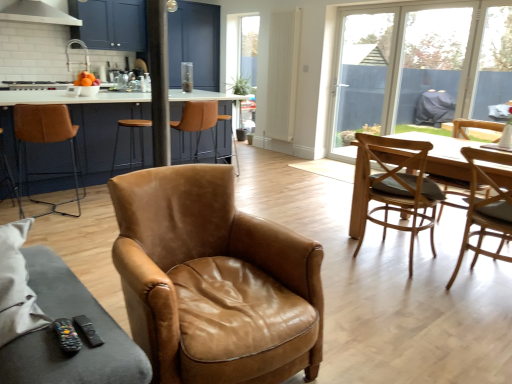
I want to click on transparent glass window at upper right, the third window screen when ordered from left to right, so click(x=494, y=63).

Where is `matte brown table at center`? This screenshot has height=384, width=512. matte brown table at center is located at coordinates (67, 97).

Measure the distance between white glossy exhaust hood at upper left and camera.

white glossy exhaust hood at upper left and camera are 3.95 meters apart from each other.

Describe the element at coordinates (485, 209) in the screenshot. This screenshot has width=512, height=384. I see `light brown leather chair at right, placed as the 2th chair when sorted from right to left` at that location.

The height and width of the screenshot is (384, 512). Identify the location of transparent glass window at upper right, the third window screen when ordered from left to right. (494, 63).

Can you confirm if brown leather bar stool at center is wider than matte brown table at center?

No.

From a real-world perspective, is brown leather bar stool at center above or below matte brown table at center?

Clearly, from a real-world perspective, brown leather bar stool at center is below matte brown table at center.

Based on the photo, is brown leather bar stool at center with matte brown table at center?

No, brown leather bar stool at center is not touching matte brown table at center.

Can you tell me how much brown leather bar stool at center and matte brown table at center differ in facing direction?

178 degrees.

Which is less distant, [150,122] or [474,182]?

Point [150,122] is farther from the camera than point [474,182].

Would you consider brown leather stool at center to be distant from light brown leather chair at right, placed as the 2th chair when sorted from right to left?

Indeed, brown leather stool at center is not near light brown leather chair at right, placed as the 2th chair when sorted from right to left.

Is transparent glass window at upper right, the third window screen when ordered from left to right, facing away from light brown wooden chair at right, the 1th chair when ordered from right to left?

transparent glass window at upper right, the third window screen when ordered from left to right, is not turned away from light brown wooden chair at right, the 1th chair when ordered from right to left.

From the image's perspective, is transparent glass window at upper right, positioned as the first window screen in right-to-left order, above or below light brown wooden chair at right, the 1th chair when ordered from right to left?

From the image's perspective, transparent glass window at upper right, positioned as the first window screen in right-to-left order, appears above light brown wooden chair at right, the 1th chair when ordered from right to left.

Which is more to the left, transparent glass window at upper right, the third window screen when ordered from left to right, or light brown wooden chair at right, which appears as the 6th chair when viewed from the left?

light brown wooden chair at right, which appears as the 6th chair when viewed from the left.

From a real-world perspective, is transparent glass window at upper right, the third window screen when ordered from left to right, physically located above or below light brown wooden chair at right, which appears as the 6th chair when viewed from the left?

Clearly, from a real-world perspective, transparent glass window at upper right, the third window screen when ordered from left to right, is above light brown wooden chair at right, which appears as the 6th chair when viewed from the left.

From the image's perspective, between light brown leather chair at right, which is counted as the fifth chair, starting from the left, and transparent glass window at upper right, the third window screen when ordered from left to right, who is located below?

From the image's view, light brown leather chair at right, which is counted as the fifth chair, starting from the left, is below.

Looking at this image, relative to transparent glass window at upper right, positioned as the first window screen in right-to-left order, is light brown leather chair at right, which is counted as the fifth chair, starting from the left, in front or behind?

light brown leather chair at right, which is counted as the fifth chair, starting from the left, is in front of transparent glass window at upper right, positioned as the first window screen in right-to-left order.

Is transparent glass window at upper right, the third window screen when ordered from left to right, at the back of light brown leather chair at right, which is counted as the fifth chair, starting from the left?

No, transparent glass window at upper right, the third window screen when ordered from left to right, is not at the back of light brown leather chair at right, which is counted as the fifth chair, starting from the left.

Considering the sizes of objects black plastic remote at lower left and brown leather stool at center in the image provided, who is shorter, black plastic remote at lower left or brown leather stool at center?

black plastic remote at lower left.

Which object is more forward, black plastic remote at lower left or brown leather stool at center?

black plastic remote at lower left is in front.

Looking at their sizes, would you say black plastic remote at lower left is wider or thinner than brown leather stool at center?

Considering their sizes, black plastic remote at lower left looks slimmer than brown leather stool at center.

Based on the photo, does light brown wooden chair at right, which appears as the 6th chair when viewed from the left, have a lesser height compared to light brown leather chair at right, placed as the 2th chair when sorted from right to left?

No.

Could light brown leather chair at right, which is counted as the fifth chair, starting from the left, be considered to be inside light brown wooden chair at right, the 1th chair when ordered from right to left?

No.

From the image's perspective, is light brown wooden chair at right, which appears as the 6th chair when viewed from the left, positioned above or below light brown leather chair at right, which is counted as the fifth chair, starting from the left?

Based on their image positions, light brown wooden chair at right, which appears as the 6th chair when viewed from the left, is located above light brown leather chair at right, which is counted as the fifth chair, starting from the left.

From a real-world perspective, which object stands above the other?

light brown leather chair at right, which is counted as the fifth chair, starting from the left.

In the image, is light brown leather chair at right, which is counted as the fifth chair, starting from the left, positioned in front of or behind white glossy exhaust hood at upper left?

In the image, light brown leather chair at right, which is counted as the fifth chair, starting from the left, appears in front of white glossy exhaust hood at upper left.

From the image's perspective, is light brown leather chair at right, which is counted as the fifth chair, starting from the left, under white glossy exhaust hood at upper left?

Yes.

Choose the correct answer: Is light brown leather chair at right, which is counted as the fifth chair, starting from the left, inside white glossy exhaust hood at upper left or outside it?

light brown leather chair at right, which is counted as the fifth chair, starting from the left, is not inside white glossy exhaust hood at upper left, it's outside.

Which of these two, light brown leather chair at right, which is counted as the fifth chair, starting from the left, or white glossy exhaust hood at upper left, is bigger?

light brown leather chair at right, which is counted as the fifth chair, starting from the left.

I want to click on bar stool below the matte brown table at center (from the image's perspective), so click(x=224, y=120).

The image size is (512, 384). In the image, there is a light brown leather chair at right, which is counted as the fifth chair, starting from the left. What are the coordinates of `stool above it (from the image's perspective)` in the screenshot? It's located at (131, 142).

From the image, which object appears to be nearer to brown leather armchair at center, which is the third chair from left to right, brown leather stool at center or brown leather chair at center, the 2th chair from the left?

The object closer to brown leather armchair at center, which is the third chair from left to right, is brown leather chair at center, the 2th chair from the left.

Which object lies nearer to the anchor point brown leather bar stool at left, arranged as the sixth chair when viewed from the right, brown leather armchair at center, which is the third chair from left to right, or matte brown table at center?

The object closer to brown leather bar stool at left, arranged as the sixth chair when viewed from the right, is matte brown table at center.

Which object lies further to the anchor point brown leather armchair at center, acting as the 4th chair starting from the right, transparent glass window at upper right, the third window screen when ordered from left to right, or light brown wooden chair at right, which appears as the third chair when viewed from the right?

Among the two, transparent glass window at upper right, the third window screen when ordered from left to right, is located further to brown leather armchair at center, acting as the 4th chair starting from the right.

Estimate the real-world distances between objects in this image. Which object is further from brown leather bar stool at left, arranged as the sixth chair when viewed from the right, transparent glass door at center, the 3th window screen in the right-to-left sequence, or brown leather stool at center?

transparent glass door at center, the 3th window screen in the right-to-left sequence, is further to brown leather bar stool at left, arranged as the sixth chair when viewed from the right.

Looking at the image, which one is located further to white glossy exhaust hood at upper left, transparent glass screen door at upper center or transparent glass window at upper right, the third window screen when ordered from left to right?

Based on the image, transparent glass window at upper right, the third window screen when ordered from left to right, appears to be further to white glossy exhaust hood at upper left.

Consider the image. Looking at the image, which one is located further to transparent glass screen door at upper center, brown leather chair at center, the 2th chair from the left, or light brown wooden chair at right, the 4th chair from the left?

Based on the image, light brown wooden chair at right, the 4th chair from the left, appears to be further to transparent glass screen door at upper center.

From the image, which object appears to be nearer to light brown leather chair at right, which is counted as the fifth chair, starting from the left, transparent plastic window screen at right, the second window screen in the right-to-left sequence, or brown leather bar stool at center?

brown leather bar stool at center lies closer to light brown leather chair at right, which is counted as the fifth chair, starting from the left, than the other object.

Estimate the real-world distances between objects in this image. Which object is closer to transparent glass screen door at upper center, brown leather bar stool at left, arranged as the sixth chair when viewed from the right, or brown leather armchair at center, acting as the 4th chair starting from the right?

Based on the image, brown leather bar stool at left, arranged as the sixth chair when viewed from the right, appears to be nearer to transparent glass screen door at upper center.

The width and height of the screenshot is (512, 384). In order to click on table between brown leather bar stool at left, which appears as the first chair when viewed from the left, and transparent plastic window screen at right, the second window screen in the right-to-left sequence, in the horizontal direction in this screenshot , I will do `click(67, 97)`.

Identify the location of screen door between white glossy exhaust hood at upper left and transparent glass door at center, the 3th window screen in the right-to-left sequence. The width and height of the screenshot is (512, 384). (195, 44).

The height and width of the screenshot is (384, 512). Find the location of `screen door between brown leather bar stool at left, arranged as the sixth chair when viewed from the right, and transparent plastic window screen at right, the 2th window screen positioned from the left, in the horizontal direction`. screen door between brown leather bar stool at left, arranged as the sixth chair when viewed from the right, and transparent plastic window screen at right, the 2th window screen positioned from the left, in the horizontal direction is located at coordinates (195, 44).

Where is `table between brown leather armchair at center, acting as the 4th chair starting from the right, and white glossy exhaust hood at upper left from front to back`? The image size is (512, 384). table between brown leather armchair at center, acting as the 4th chair starting from the right, and white glossy exhaust hood at upper left from front to back is located at coordinates (67, 97).